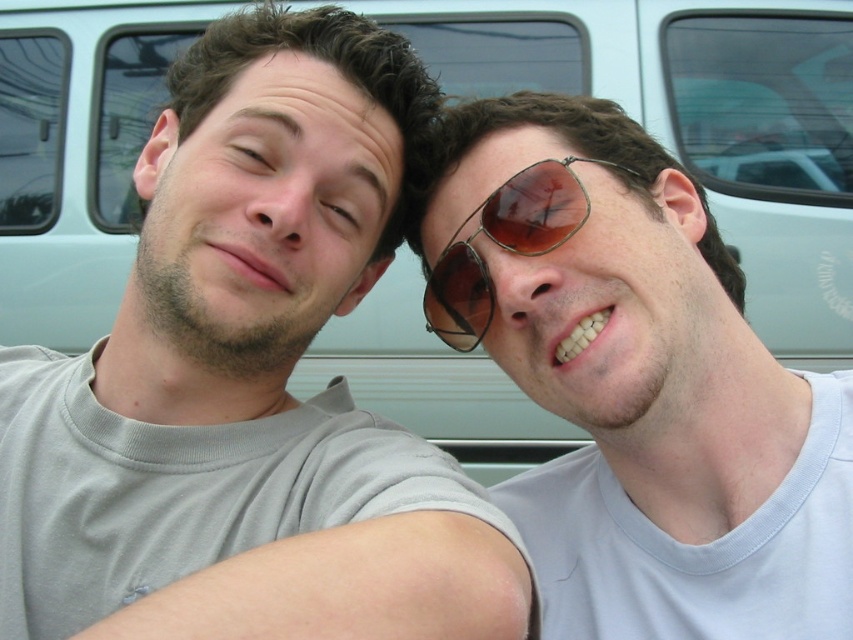
Consider the image. Is gray matte t-shirt at left positioned before metal aviator sunglasses at center?

Yes, gray matte t-shirt at left is closer to the viewer.

Does gray matte t-shirt at left have a greater height compared to metal aviator sunglasses at center?

Correct, gray matte t-shirt at left is much taller as metal aviator sunglasses at center.

At what (x,y) coordinates should I click in order to perform the action: click on gray matte t-shirt at left. Please return your answer as a coordinate pair (x, y). The image size is (853, 640). Looking at the image, I should click on (248, 384).

Is brown matte eye at center wider than matte skin at center?

Correct, the width of brown matte eye at center exceeds that of matte skin at center.

Does brown matte eye at center appear over matte skin at center?

Yes.

You are a GUI agent. You are given a task and a screenshot of the screen. Output one action in this format:
    pyautogui.click(x=<x>, y=<y>)
    Task: Click on the brown matte eye at center
    The width and height of the screenshot is (853, 640).
    Given the screenshot: What is the action you would take?
    pyautogui.click(x=251, y=156)

Is gray matte t-shirt at left below matte skin at center?

Correct, gray matte t-shirt at left is located below matte skin at center.

Does gray matte t-shirt at left have a lesser width compared to matte skin at center?

No.

Locate an element on the screen. Image resolution: width=853 pixels, height=640 pixels. gray matte t-shirt at left is located at coordinates coord(248,384).

Locate an element on the screen. This screenshot has width=853, height=640. gray matte t-shirt at left is located at coordinates (248, 384).